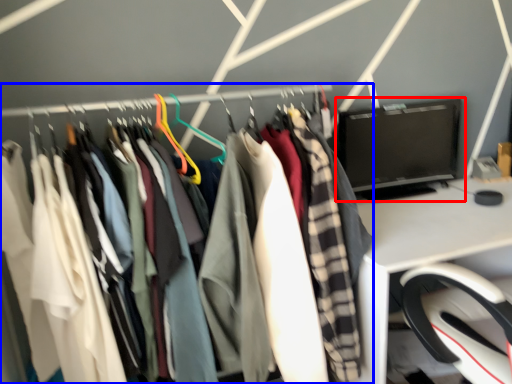
Question: Which object is closer to the camera taking this photo, computer monitor (highlighted by a red box) or closet (highlighted by a blue box)?

Choices:
 (A) computer monitor
 (B) closet

Answer: (B)